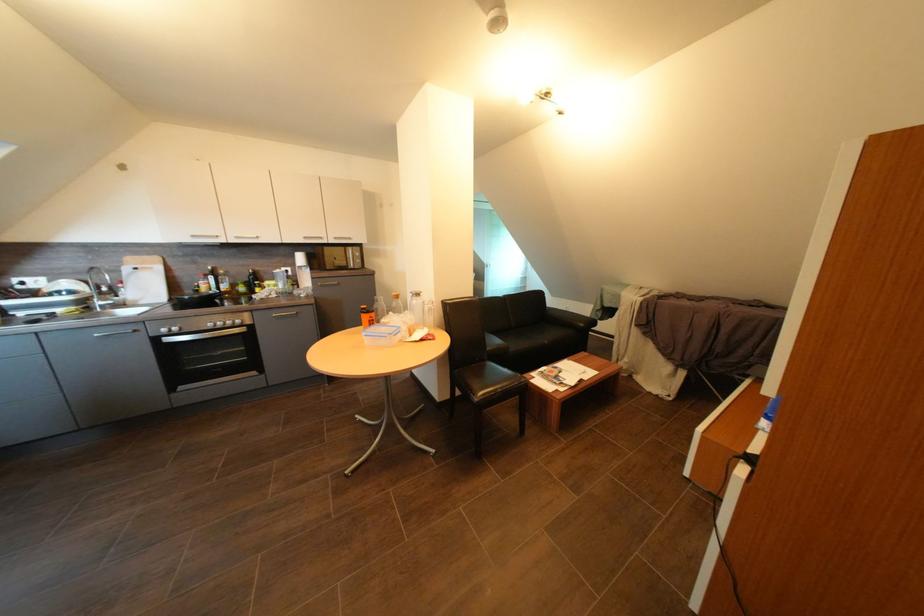
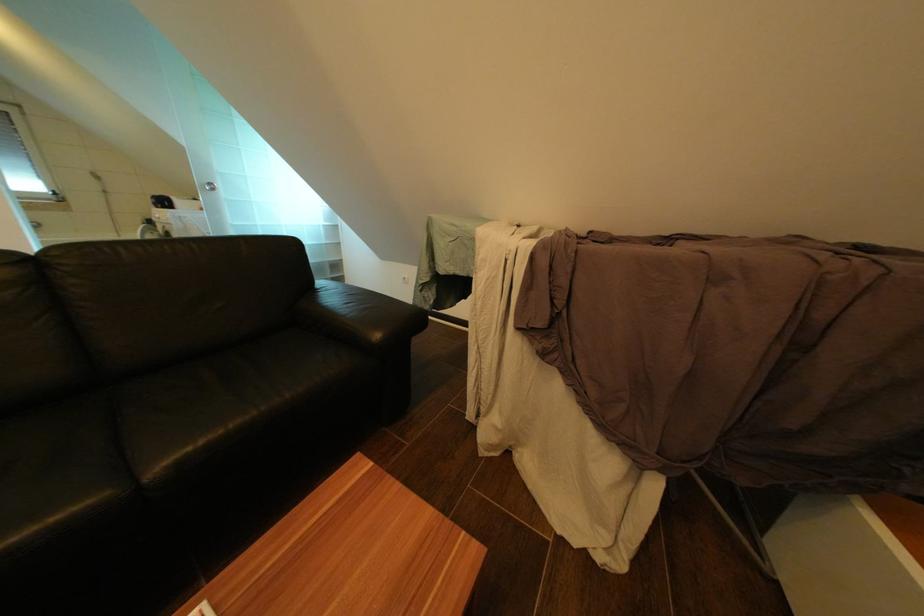
Which direction would the cameraman need to move to produce the second image?

The cameraman moved toward right, forward.